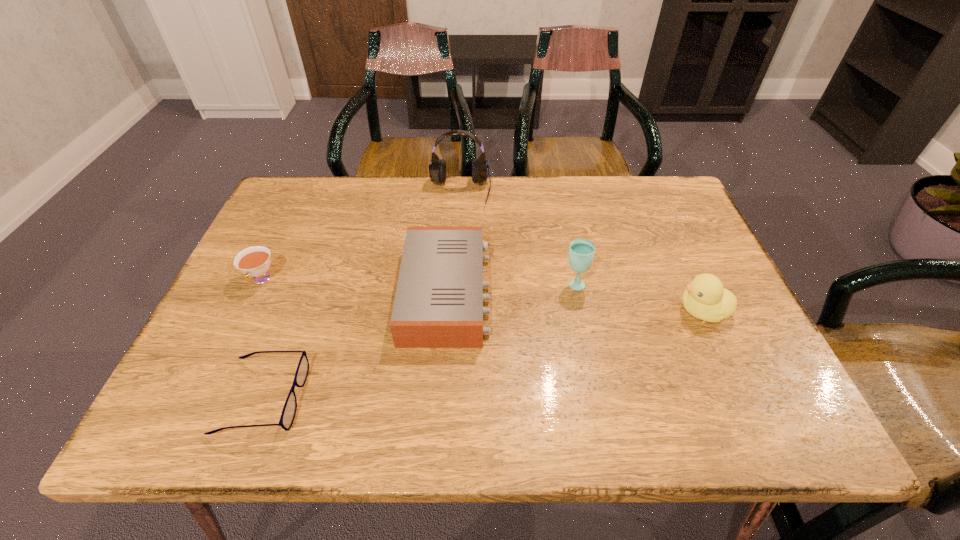
Identify the location of the tallest object. The image size is (960, 540). (437, 169).

In order to click on the farthest object in this screenshot , I will do (x=437, y=169).

At what (x,y) coordinates should I click in order to perform the action: click on glass. Please return your answer as a coordinate pair (x, y). The height and width of the screenshot is (540, 960). Looking at the image, I should click on (581, 252).

This screenshot has width=960, height=540. Identify the location of the fourth shortest object. (705, 298).

The height and width of the screenshot is (540, 960). In order to click on duckling in this screenshot , I will do pyautogui.click(x=705, y=298).

Find the location of `radio receiver`. radio receiver is located at coordinates (438, 303).

This screenshot has width=960, height=540. In order to click on teacup in this screenshot , I will do `click(254, 261)`.

Image resolution: width=960 pixels, height=540 pixels. What are the coordinates of `the shortest object` in the screenshot? It's located at (288, 414).

The height and width of the screenshot is (540, 960). In order to click on spectacles in this screenshot , I will do `click(288, 414)`.

Locate an element on the screen. This screenshot has height=540, width=960. free space located 0.220m on the ear cushions of the headset is located at coordinates (456, 264).